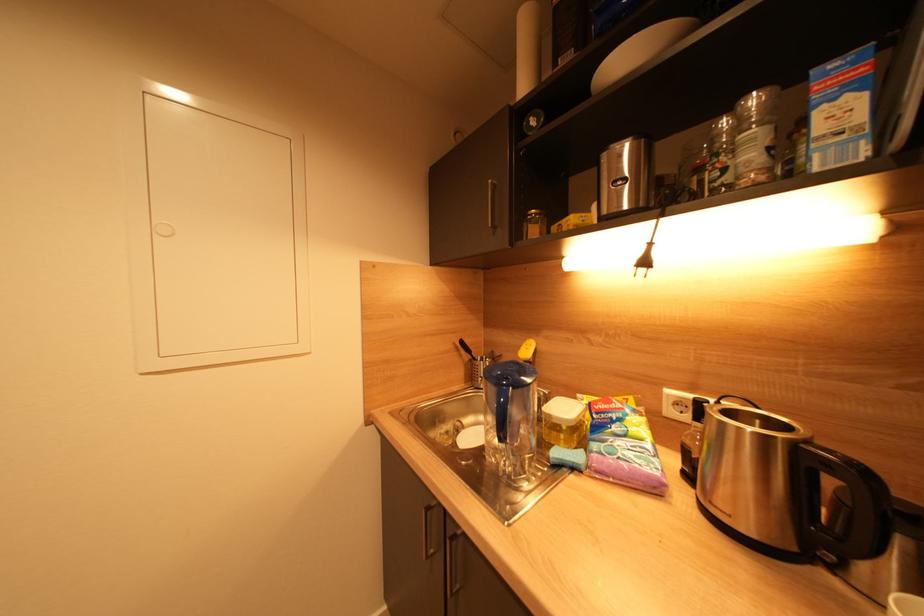
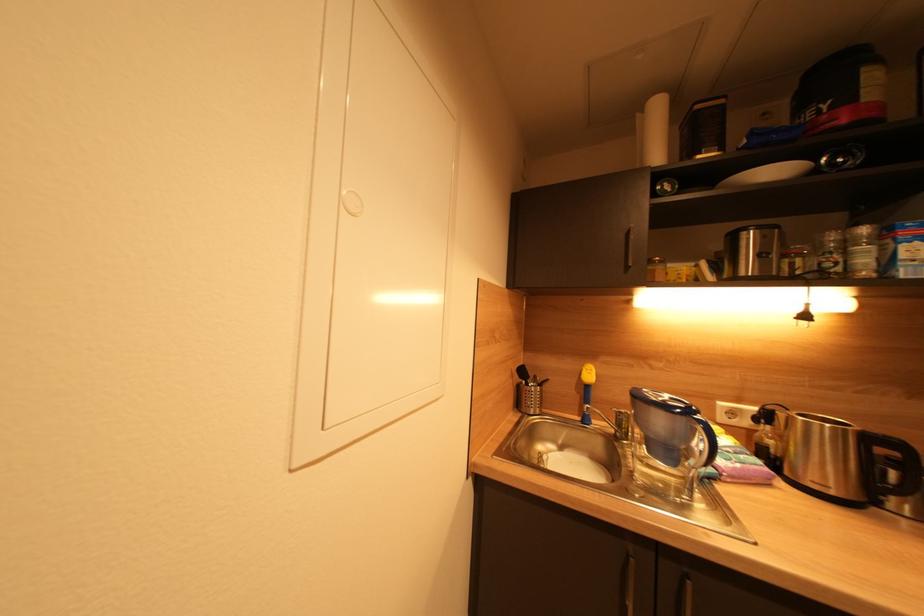
Question: The first image is from the beginning of the video and the second image is from the end. How did the camera likely rotate when shooting the video?

Choices:
 (A) Left
 (B) Right
 (C) Up
 (D) Down

Answer: (B)